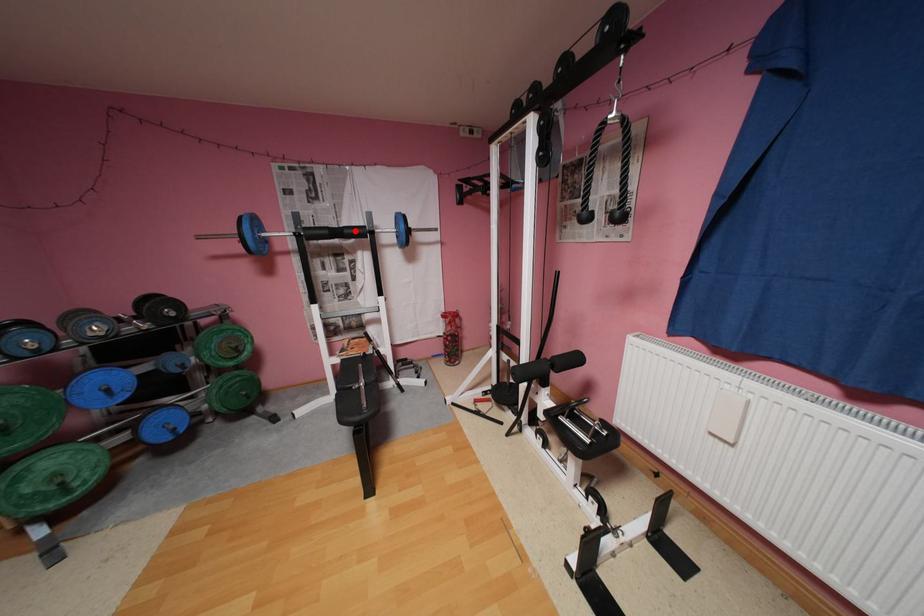
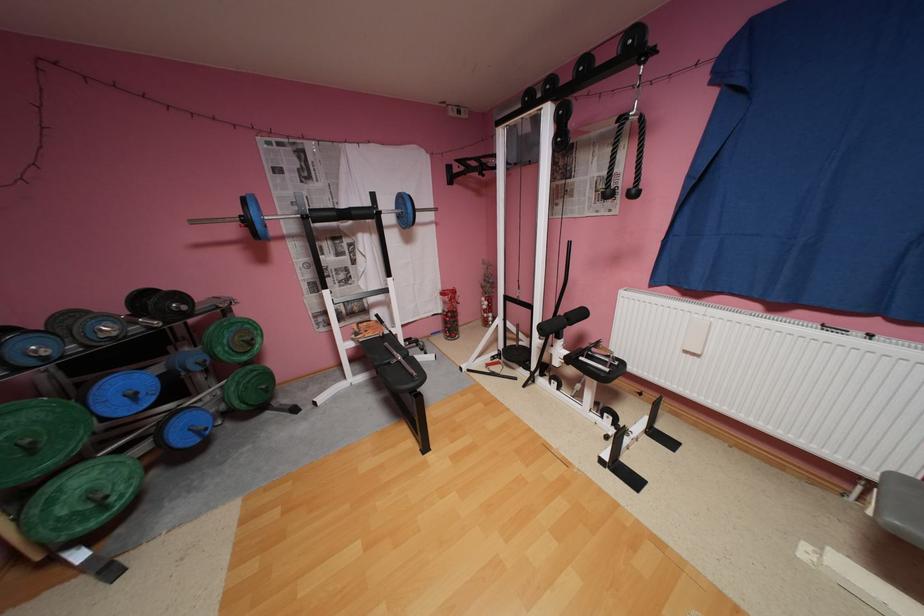
Question: A red point is marked in image1. In image2, is the corresponding 3D point closer to the camera or farther? Reply with the corresponding letter.

Choices:
 (A) The corresponding 3D point is closer.
 (B) The corresponding 3D point is farther.

Answer: (A)